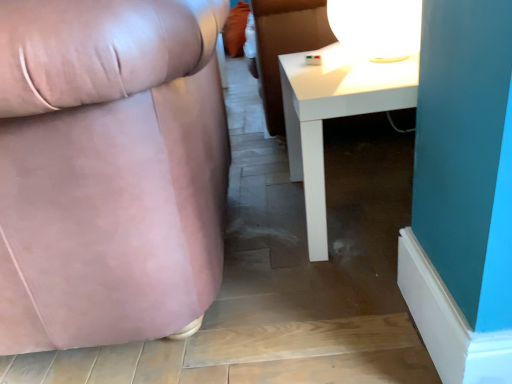
At what (x,y) coordinates should I click in order to perform the action: click on free point below white glossy table at lower right (from a real-world perspective). Please return your answer as a coordinate pair (x, y). The image size is (512, 384). Looking at the image, I should click on (367, 200).